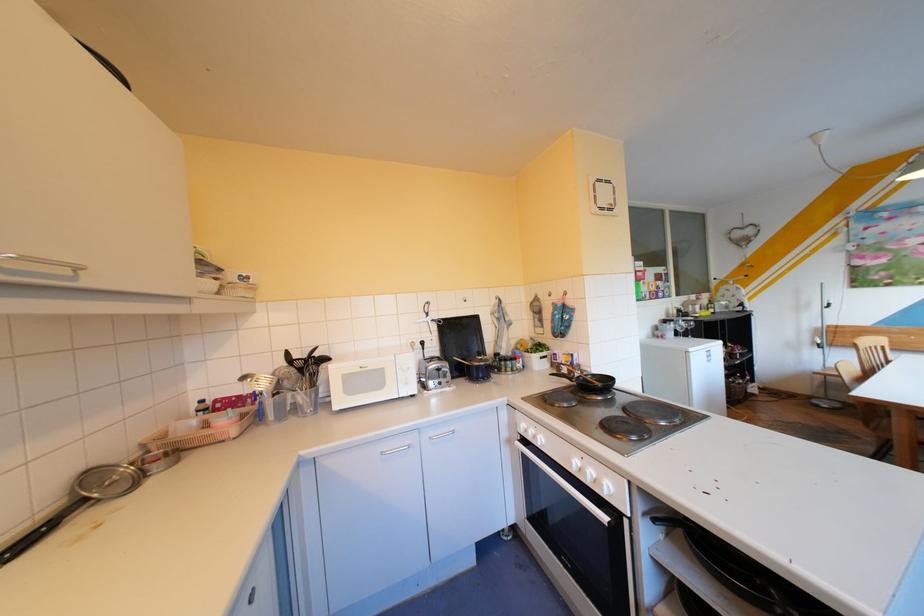
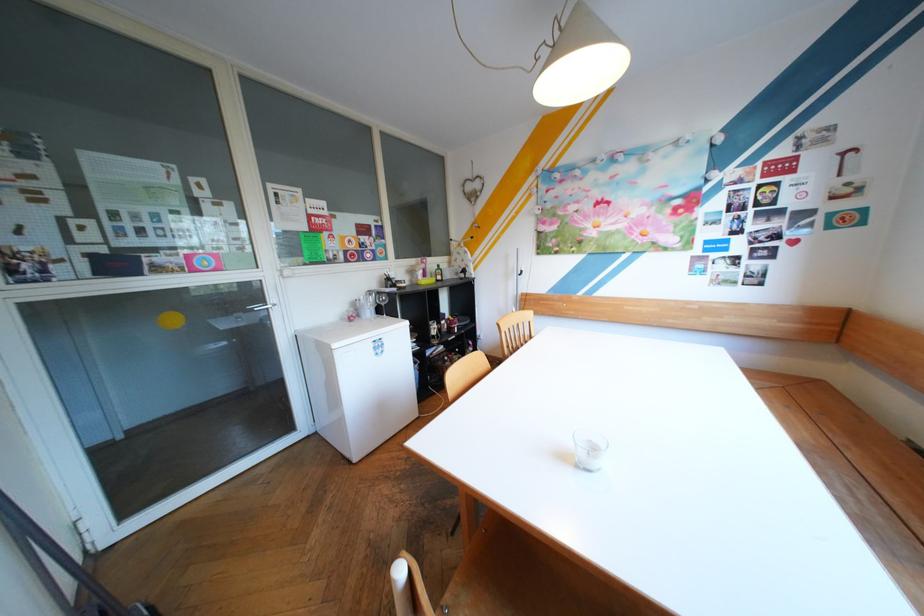
Find the pixel in the second image that matches point (711, 305) in the first image.

(434, 270)